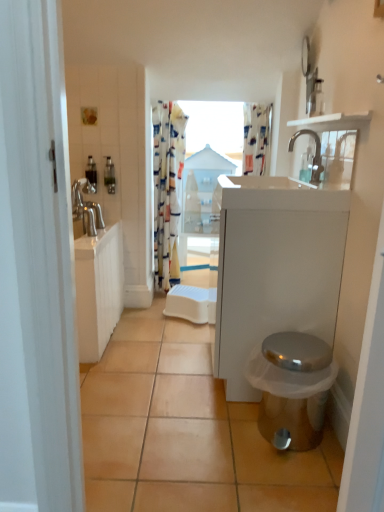
Locate an element on the screen. The width and height of the screenshot is (384, 512). vacant space positioned to the left of shiny metallic toilet at lower right is located at coordinates (240, 440).